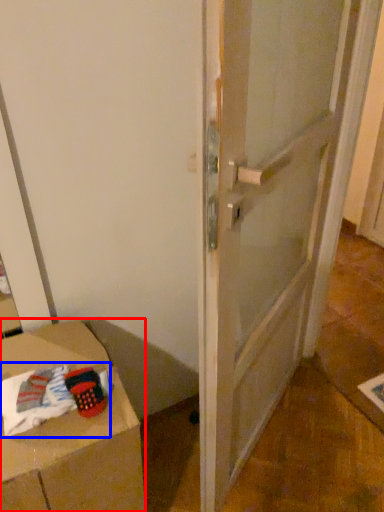
Question: Which object appears farthest to the camera in this image, furniture (highlighted by a red box) or laundry (highlighted by a blue box)?

Choices:
 (A) furniture
 (B) laundry

Answer: (B)